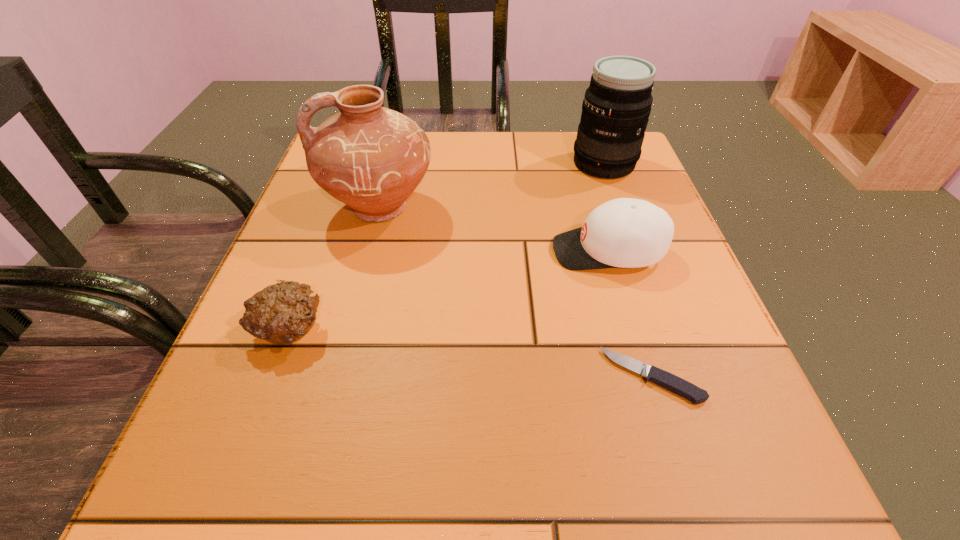
At what (x,y) coordinates should I click in order to perform the action: click on pottery. Please return your answer as a coordinate pair (x, y). Looking at the image, I should click on (371, 158).

Where is `telephoto lens`? This screenshot has height=540, width=960. telephoto lens is located at coordinates click(617, 104).

I want to click on baseball cap, so click(625, 232).

I want to click on the second shortest object, so click(x=282, y=313).

This screenshot has height=540, width=960. I want to click on the shortest object, so click(669, 381).

Where is `vacant region located 0.050m on the side of the pottery with the handle`? Image resolution: width=960 pixels, height=540 pixels. vacant region located 0.050m on the side of the pottery with the handle is located at coordinates (300, 208).

This screenshot has width=960, height=540. In order to click on vacant space located on the front of the telephoto lens in this screenshot , I will do `click(639, 261)`.

What are the coordinates of `vacant region located 0.330m on the front-facing side of the baseball cap` in the screenshot? It's located at (379, 251).

The image size is (960, 540). Identify the location of vacant region located on the front-facing side of the baseball cap. (411, 251).

What are the coordinates of `vacant space located 0.220m on the front-facing side of the baseball cap` in the screenshot? It's located at (437, 251).